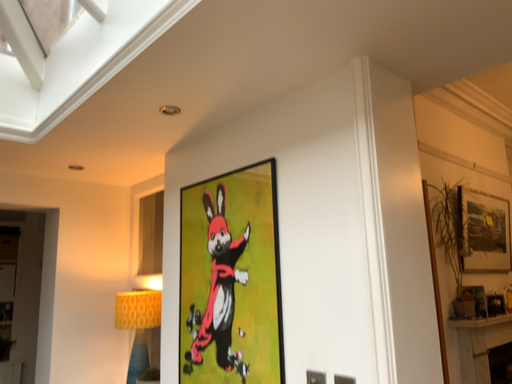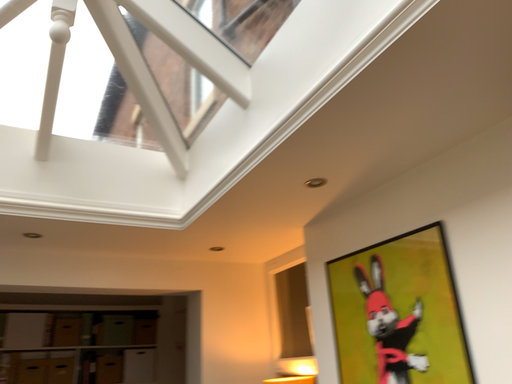
Question: Which way did the camera rotate in the video?

Choices:
 (A) rotated downward
 (B) rotated upward

Answer: (B)